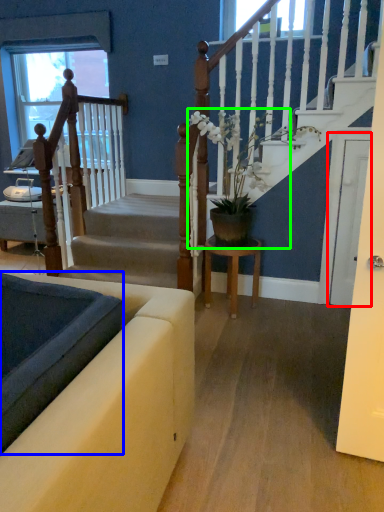
Question: Estimate the real-world distances between objects in this image. Which object is farther from glass door (highlighted by a red box), landing (highlighted by a blue box) or houseplant (highlighted by a green box)?

Choices:
 (A) landing
 (B) houseplant

Answer: (A)